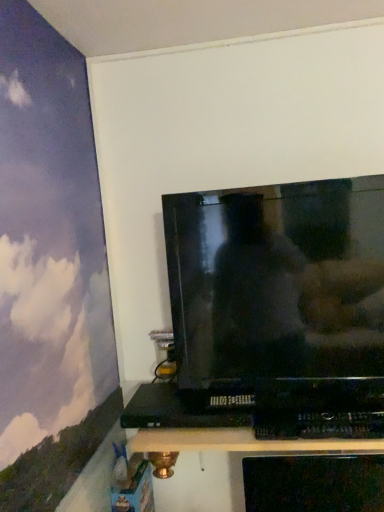
Identify the location of vacant region above black plastic dvd player at lower center (from a real-world perspective). The height and width of the screenshot is (512, 384). (177, 400).